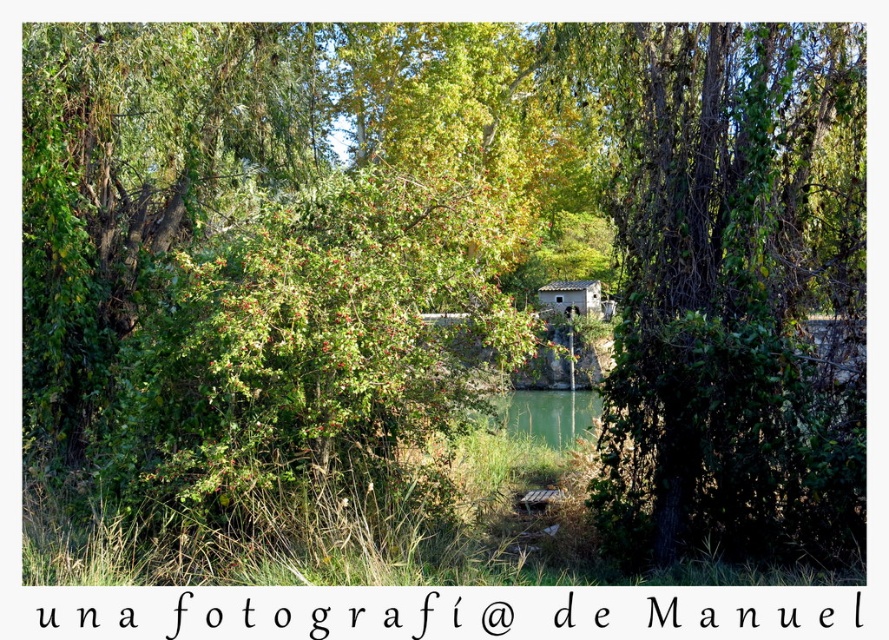
Is green leafy tree at center bigger than rustic stone hut at center?

Yes, green leafy tree at center is bigger than rustic stone hut at center.

Who is lower down, green leafy tree at center or rustic stone hut at center?

Positioned lower is green leafy tree at center.

Measure the distance between green leafy tree at center and camera.

They are 23.56 feet apart.

In order to click on green leafy tree at center in this screenshot , I will do `click(737, 294)`.